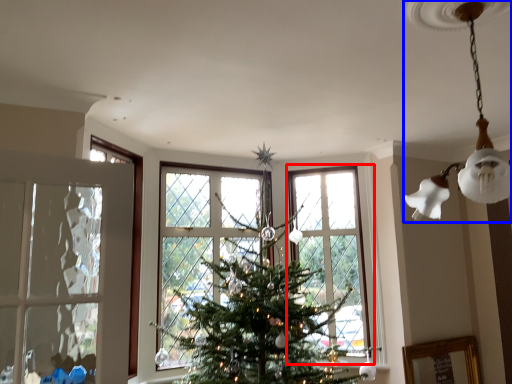
Question: Which object appears farthest to the camera in this image, window (highlighted by a red box) or lamp (highlighted by a blue box)?

Choices:
 (A) window
 (B) lamp

Answer: (A)